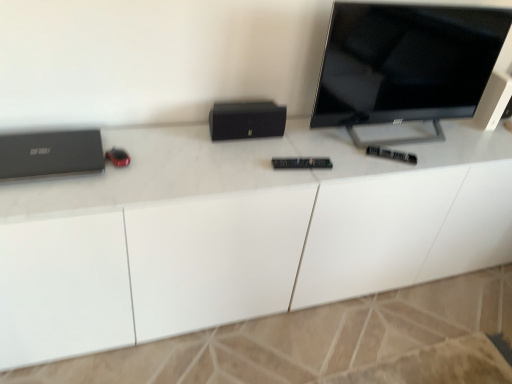
Question: From the image's perspective, is white glossy desk at center beneath black glossy tv at upper right?

Choices:
 (A) yes
 (B) no

Answer: (A)

Question: Is white glossy desk at center positioned beyond the bounds of black glossy tv at upper right?

Choices:
 (A) no
 (B) yes

Answer: (B)

Question: Does white glossy desk at center come in front of black glossy tv at upper right?

Choices:
 (A) no
 (B) yes

Answer: (B)

Question: Considering the relative sizes of white glossy desk at center and black glossy tv at upper right in the image provided, is white glossy desk at center bigger than black glossy tv at upper right?

Choices:
 (A) yes
 (B) no

Answer: (A)

Question: Is white glossy desk at center surrounding black glossy tv at upper right?

Choices:
 (A) yes
 (B) no

Answer: (B)

Question: Is point (482, 112) positioned closer to the camera than point (75, 286)?

Choices:
 (A) farther
 (B) closer

Answer: (A)

Question: Considering the positions of black matte speaker at upper right and white glossy desk at center in the image, is black matte speaker at upper right taller or shorter than white glossy desk at center?

Choices:
 (A) short
 (B) tall

Answer: (A)

Question: From a real-world perspective, is black matte speaker at upper right physically located above or below white glossy desk at center?

Choices:
 (A) below
 (B) above

Answer: (B)

Question: In terms of size, does black matte speaker at upper right appear bigger or smaller than white glossy desk at center?

Choices:
 (A) big
 (B) small

Answer: (B)

Question: Considering the positions of point (332, 36) and point (33, 167), is point (332, 36) closer or farther from the camera than point (33, 167)?

Choices:
 (A) closer
 (B) farther

Answer: (B)

Question: In the image, is black glossy tv at upper right on the left side or the right side of matte black laptop at left?

Choices:
 (A) left
 (B) right

Answer: (B)

Question: Looking at the image, does black glossy tv at upper right seem bigger or smaller compared to matte black laptop at left?

Choices:
 (A) small
 (B) big

Answer: (B)

Question: From a real-world perspective, is black glossy tv at upper right above or below matte black laptop at left?

Choices:
 (A) below
 (B) above

Answer: (B)

Question: Is black matte speaker at upper right taller or shorter than black plastic remote at center?

Choices:
 (A) short
 (B) tall

Answer: (B)

Question: From the image's perspective, is black matte speaker at upper right located above or below black plastic remote at center?

Choices:
 (A) above
 (B) below

Answer: (A)